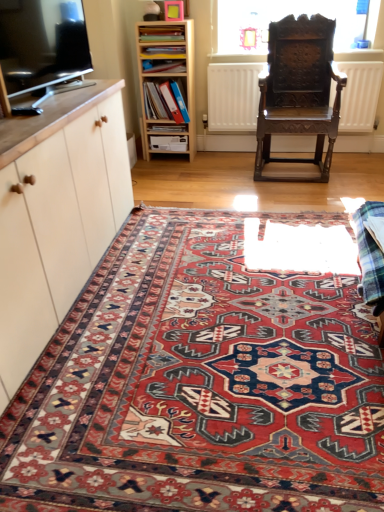
Question: Is matte cardboard book at center, positioned as the 1th book in bottom-to-top order, next to matte blue book at upper center, acting as the 3th book starting from the top, and touching it?

Choices:
 (A) yes
 (B) no

Answer: (B)

Question: Would you consider matte cardboard book at center, positioned as the 1th book in bottom-to-top order, to be distant from matte blue book at upper center, acting as the 3th book starting from the top?

Choices:
 (A) yes
 (B) no

Answer: (B)

Question: Can you confirm if matte cardboard book at center, positioned as the 1th book in bottom-to-top order, is bigger than matte blue book at upper center, acting as the 3th book starting from the top?

Choices:
 (A) yes
 (B) no

Answer: (A)

Question: From the image's perspective, is matte cardboard book at center, positioned as the 1th book in bottom-to-top order, above matte blue book at upper center, which appears as the second book when ordered from the bottom?

Choices:
 (A) no
 (B) yes

Answer: (A)

Question: Is matte blue book at upper center, acting as the 3th book starting from the top, at the back of matte cardboard book at center, positioned as the 1th book in bottom-to-top order?

Choices:
 (A) yes
 (B) no

Answer: (B)

Question: From their relative heights in the image, would you say plaid fabric at lower right is taller or shorter than matte cardboard book at center, positioned as the 1th book in bottom-to-top order?

Choices:
 (A) short
 (B) tall

Answer: (B)

Question: From the image's perspective, relative to matte cardboard book at center, the fourth book positioned from the top, is plaid fabric at lower right above or below?

Choices:
 (A) below
 (B) above

Answer: (A)

Question: Based on their positions, is plaid fabric at lower right located to the left or right of matte cardboard book at center, the fourth book positioned from the top?

Choices:
 (A) right
 (B) left

Answer: (A)

Question: From a real-world perspective, is plaid fabric at lower right positioned above or below matte cardboard book at center, the fourth book positioned from the top?

Choices:
 (A) above
 (B) below

Answer: (B)

Question: From a real-world perspective, relative to matte blue book at upper center, acting as the 3th book starting from the top, is transparent glass window at upper center vertically above or below?

Choices:
 (A) above
 (B) below

Answer: (A)

Question: In terms of height, does transparent glass window at upper center look taller or shorter compared to matte blue book at upper center, acting as the 3th book starting from the top?

Choices:
 (A) short
 (B) tall

Answer: (B)

Question: Looking at the image, does transparent glass window at upper center seem bigger or smaller compared to matte blue book at upper center, which appears as the second book when ordered from the bottom?

Choices:
 (A) big
 (B) small

Answer: (A)

Question: In terms of width, does transparent glass window at upper center look wider or thinner when compared to matte blue book at upper center, which appears as the second book when ordered from the bottom?

Choices:
 (A) wide
 (B) thin

Answer: (B)

Question: Is matte white cabinet at left inside or outside of matte cardboard book at center, positioned as the 1th book in bottom-to-top order?

Choices:
 (A) inside
 (B) outside

Answer: (B)

Question: Would you say matte white cabinet at left is to the left or to the right of matte cardboard book at center, the fourth book positioned from the top, in the picture?

Choices:
 (A) right
 (B) left

Answer: (B)